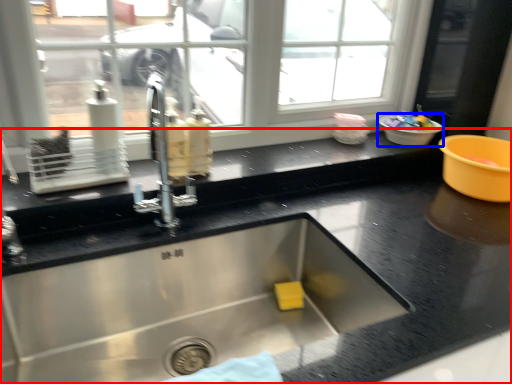
Question: Which of the following is the closest to the observer, countertop (highlighted by a red box) or basin (highlighted by a blue box)?

Choices:
 (A) countertop
 (B) basin

Answer: (A)